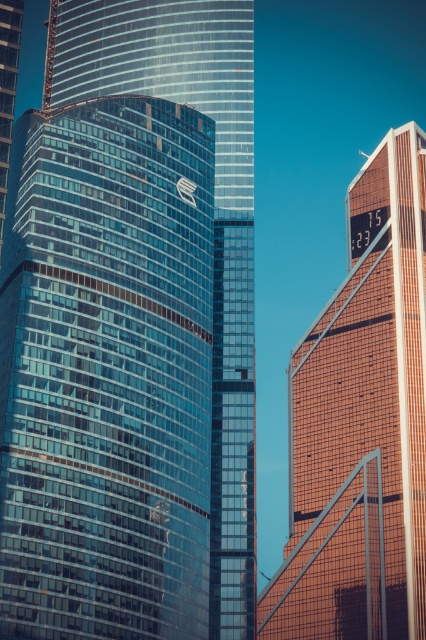
You are standing at the origin point of the coordinate system in the image. You want to take a photo of the glassy blue skyscraper at center. Which direction should you move to get closer to it?

The glassy blue skyscraper at center is located at coordinate point (131, 330), so you should move towards the northeast direction to get closer to it.

You are a drone operator tasked with flying a drone between the glassy blue skyscraper at center and the orange glass skyscraper at right. The drone requires a minimum of 30 meters of clearance between the two structures to safely navigate. Can the drone safely pass between them?

The glassy blue skyscraper at center and orange glass skyscraper at right are 34.29 meters apart, which exceeds the required 30 meters of clearance. Therefore, the drone can safely pass between them.